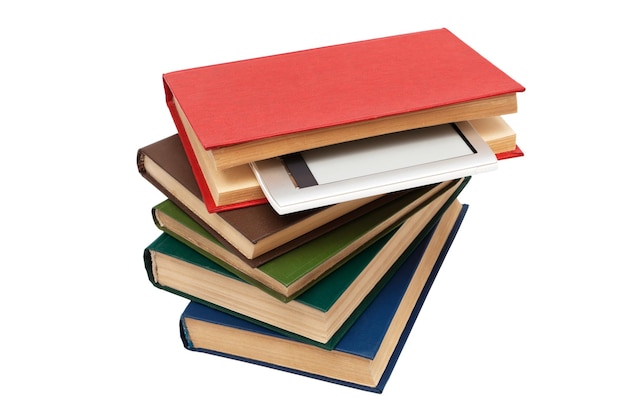
Where is `books`? Image resolution: width=626 pixels, height=417 pixels. books is located at coordinates (225, 338), (185, 283), (183, 227), (178, 184), (218, 140).